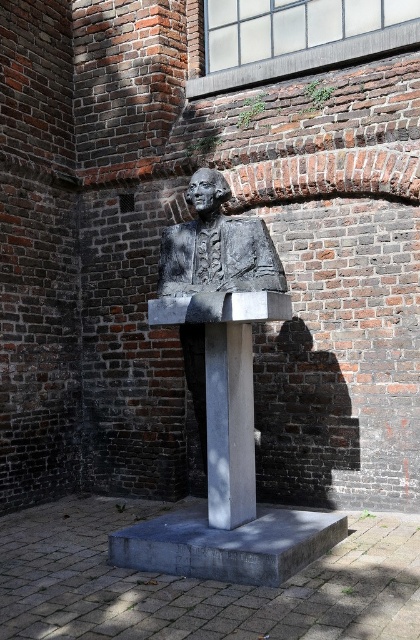
Between bronze bust at center and bronze statue at center, which one appears on the left side from the viewer's perspective?

bronze statue at center

Who is higher up, bronze bust at center or bronze statue at center?

bronze statue at center is above.

Is point (207, 252) positioned before point (236, 272)?

No, it is not.

At what (x,y) coordinates should I click in order to perform the action: click on bronze bust at center. Please return your answer as a coordinate pair (x, y). Image resolution: width=420 pixels, height=640 pixels. Looking at the image, I should click on (217, 248).